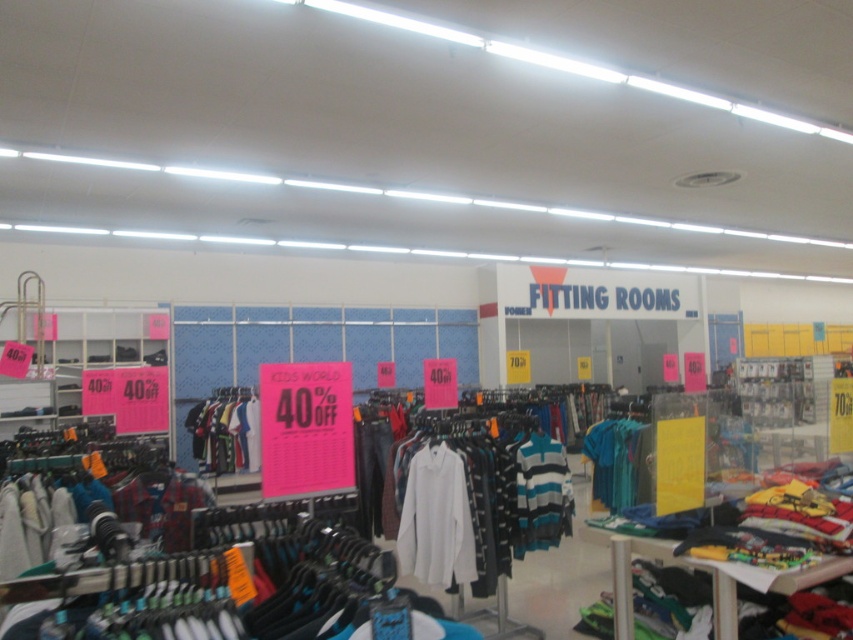
Question: Does striped cotton sweater at center have a smaller size compared to striped cotton shirt at center?

Choices:
 (A) no
 (B) yes

Answer: (B)

Question: Does striped cotton shirt at center come behind teal fabric shirt at center?

Choices:
 (A) no
 (B) yes

Answer: (B)

Question: Based on their relative distances, which object is farther from the white cotton shirt at center?

Choices:
 (A) teal fabric shirt at center
 (B) striped cotton sweater at center

Answer: (A)

Question: Is striped cotton shirt at center positioned at the back of teal fabric shirt at center?

Choices:
 (A) no
 (B) yes

Answer: (B)

Question: Estimate the real-world distances between objects in this image. Which object is closer to the striped cotton shirt at center?

Choices:
 (A) white cotton shirt at center
 (B) teal fabric shirt at center

Answer: (B)

Question: Which of the following is the closest to the observer?

Choices:
 (A) [549, 528]
 (B) [239, 388]

Answer: (A)